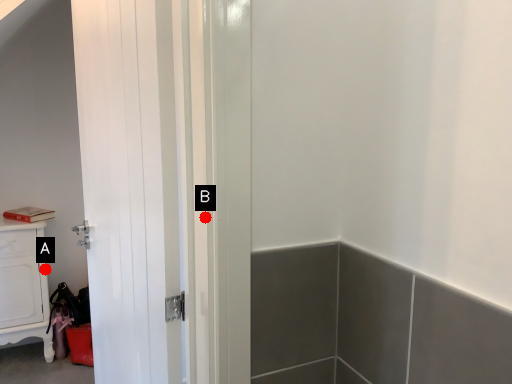
Question: Two points are circled on the image, labeled by A and B beside each circle. Which point is closer to the camera taking this photo?

Choices:
 (A) A is closer
 (B) B is closer

Answer: (B)